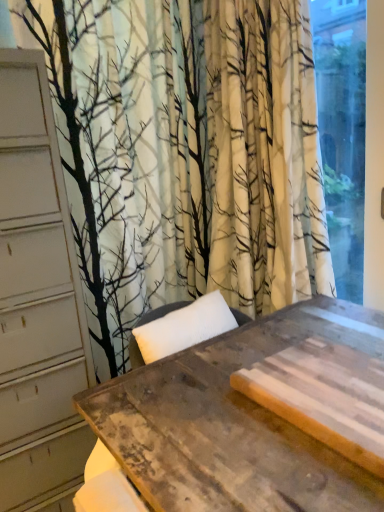
Locate an element on the screen. The width and height of the screenshot is (384, 512). transparent glass window at right is located at coordinates (342, 132).

What do you see at coordinates (342, 132) in the screenshot? This screenshot has width=384, height=512. I see `transparent glass window at right` at bounding box center [342, 132].

This screenshot has width=384, height=512. Describe the element at coordinates (231, 425) in the screenshot. I see `rustic wood table at center` at that location.

The width and height of the screenshot is (384, 512). Find the location of `rustic wood table at center`. rustic wood table at center is located at coordinates (231, 425).

The image size is (384, 512). What are the coordinates of `transparent glass window at right` in the screenshot? It's located at (342, 132).

Which object is positioned more to the left, rustic wood table at center or transparent glass window at right?

From the viewer's perspective, rustic wood table at center appears more on the left side.

Is rustic wood table at center positioned in front of transparent glass window at right?

Yes, it is in front of transparent glass window at right.

Does point (322, 447) come behind point (347, 109)?

No.

From the image's perspective, is rustic wood table at center over transparent glass window at right?

Incorrect, from the image's perspective, rustic wood table at center is lower than transparent glass window at right.

From a real-world perspective, does rustic wood table at center sit lower than transparent glass window at right?

Yes, from a real-world perspective, rustic wood table at center is below transparent glass window at right.

Does rustic wood table at center have a lesser width compared to transparent glass window at right?

Incorrect, the width of rustic wood table at center is not less than that of transparent glass window at right.

Is rustic wood table at center shorter than transparent glass window at right?

Yes, rustic wood table at center is shorter than transparent glass window at right.

Considering the relative sizes of rustic wood table at center and transparent glass window at right in the image provided, is rustic wood table at center smaller than transparent glass window at right?

No.

Could transparent glass window at right be considered to be inside rustic wood table at center?

No, transparent glass window at right is located outside of rustic wood table at center.

Is rustic wood table at center next to transparent glass window at right?

No.

Could you tell me if rustic wood table at center is turned towards transparent glass window at right?

No, rustic wood table at center is not facing towards transparent glass window at right.

Consider the image. Measure the distance from rustic wood table at center to transparent glass window at right.

33.15 inches.

The width and height of the screenshot is (384, 512). In the image, there is a transparent glass window at right. Find the location of `table below it (from a real-world perspective)`. table below it (from a real-world perspective) is located at coordinates (231, 425).

Considering the relative positions of transparent glass window at right and rustic wood table at center in the image provided, is transparent glass window at right to the left of rustic wood table at center from the viewer's perspective?

Incorrect, transparent glass window at right is not on the left side of rustic wood table at center.

Relative to rustic wood table at center, is transparent glass window at right in front or behind?

Clearly, transparent glass window at right is behind rustic wood table at center.

Does point (357, 137) come behind point (75, 401)?

Yes, point (357, 137) is behind point (75, 401).

From the image's perspective, is transparent glass window at right on rustic wood table at center?

Yes, from the image's perspective, transparent glass window at right is on top of rustic wood table at center.

From a real-world perspective, who is located lower, transparent glass window at right or rustic wood table at center?

rustic wood table at center is physically lower.

Considering the sizes of objects transparent glass window at right and rustic wood table at center in the image provided, who is thinner, transparent glass window at right or rustic wood table at center?

transparent glass window at right.

Consider the image. In terms of height, does transparent glass window at right look taller or shorter compared to rustic wood table at center?

Considering their sizes, transparent glass window at right has more height than rustic wood table at center.

Who is bigger, transparent glass window at right or rustic wood table at center?

Bigger between the two is rustic wood table at center.

In the scene shown: Which is correct: transparent glass window at right is inside rustic wood table at center, or outside of it?

transparent glass window at right is spatially situated outside rustic wood table at center.

Is transparent glass window at right beside rustic wood table at center?

transparent glass window at right is not next to rustic wood table at center, and they're not touching.

Is transparent glass window at right turned away from rustic wood table at center?

No, transparent glass window at right is not facing the opposite direction of rustic wood table at center.

In the scene shown: How different are the orientations of transparent glass window at right and rustic wood table at center in degrees?

180 degrees.

This screenshot has height=512, width=384. What are the coordinates of `window positioned vertically above the rustic wood table at center (from a real-world perspective)` in the screenshot? It's located at click(x=342, y=132).

Identify the location of window above the rustic wood table at center (from the image's perspective). The height and width of the screenshot is (512, 384). point(342,132).

In the image, there is a transparent glass window at right. Identify the location of table below it (from a real-world perspective). (231, 425).